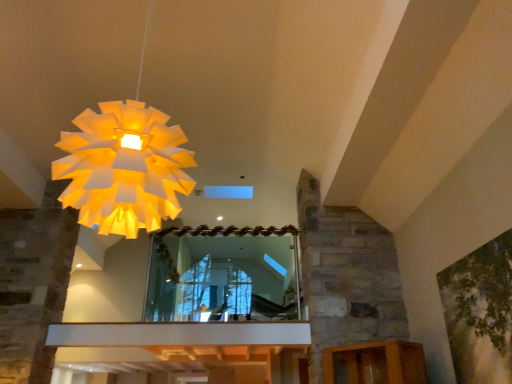
Question: Is point (477, 314) closer or farther from the camera than point (154, 269)?

Choices:
 (A) closer
 (B) farther

Answer: (A)

Question: Considering the relative positions of green leafy tree at upper right and clear glass mirror at center in the image provided, is green leafy tree at upper right to the left or to the right of clear glass mirror at center?

Choices:
 (A) left
 (B) right

Answer: (B)

Question: Which object is the closest to the clear glass mirror at center?

Choices:
 (A) white paper lampshade at upper left
 (B) green leafy tree at upper right

Answer: (B)

Question: Considering the real-world distances, which object is closest to the clear glass mirror at center?

Choices:
 (A) green leafy tree at upper right
 (B) white paper lampshade at upper left

Answer: (A)